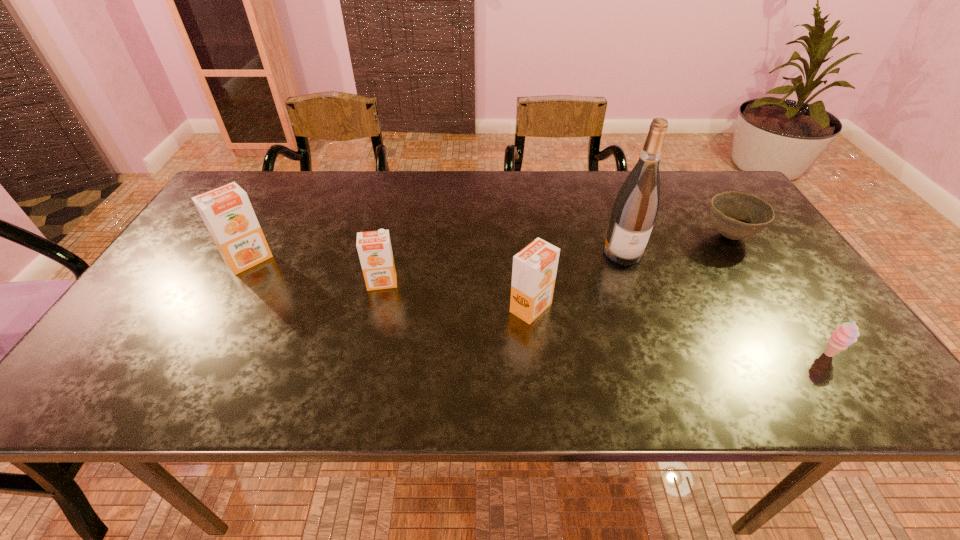
Locate an element on the screen. This screenshot has width=960, height=540. vacant area at the far edge of the desktop is located at coordinates (548, 195).

Identify the location of vacant space at the near edge. This screenshot has height=540, width=960. (433, 360).

Locate an element on the screen. This screenshot has width=960, height=540. blank space at the left edge of the desktop is located at coordinates pyautogui.click(x=205, y=237).

Identify the location of vacant space at the right edge of the desktop. (735, 276).

In the image, there is a desktop. Where is `free space at the far left corner`? free space at the far left corner is located at coordinates (270, 182).

The height and width of the screenshot is (540, 960). I want to click on free space between the fourth object from right to left and the second orange juice from left to right, so click(456, 295).

You are a GUI agent. You are given a task and a screenshot of the screen. Output one action in this format:
    pyautogui.click(x=<x>, y=<y>)
    Task: Click on the free space between the sherbert and the fifth object from right to left
    The image size is (960, 540).
    Given the screenshot: What is the action you would take?
    pyautogui.click(x=605, y=319)

Where is `empty space between the bowl and the nearest object`? The image size is (960, 540). empty space between the bowl and the nearest object is located at coordinates (779, 295).

This screenshot has height=540, width=960. What are the coordinates of `vacant space in between the nearest orange juice and the fourth object from left to right` in the screenshot? It's located at (577, 280).

Locate an element on the screen. Image resolution: width=960 pixels, height=540 pixels. vacant region between the bowl and the leftmost object is located at coordinates (489, 248).